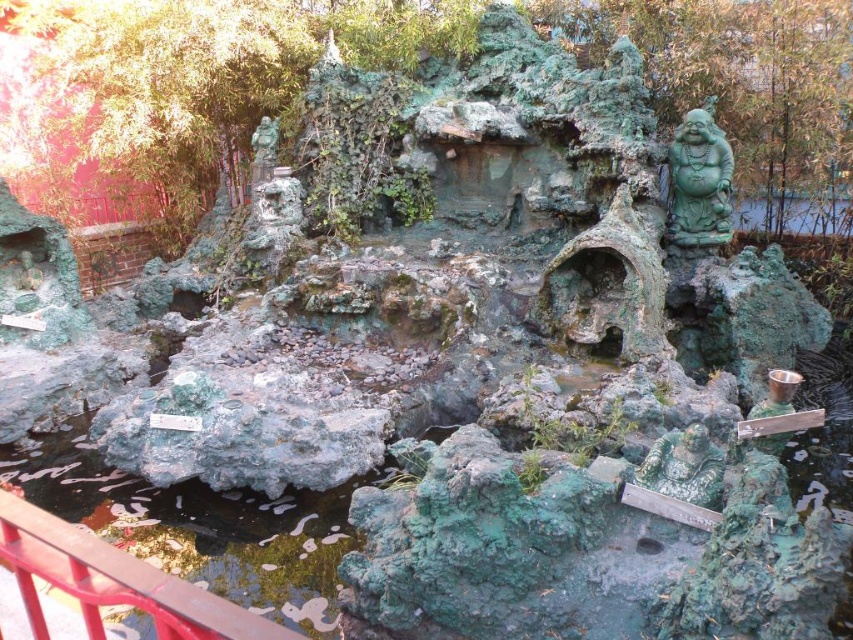
Question: Which of the following is the farthest from the observer?

Choices:
 (A) red metal railing at lower left
 (B) green patina statue at lower right
 (C) green patina statue at upper right

Answer: (C)

Question: Which is nearer to the green patina statue at upper right?

Choices:
 (A) red metal railing at lower left
 (B) green patina statue at lower right

Answer: (B)

Question: Does red metal railing at lower left appear on the left side of green patina statue at lower right?

Choices:
 (A) yes
 (B) no

Answer: (A)

Question: Is green patina statue at upper right smaller than green patina statue at lower right?

Choices:
 (A) no
 (B) yes

Answer: (A)

Question: Is green patina statue at upper right closer to the viewer compared to green patina statue at lower right?

Choices:
 (A) no
 (B) yes

Answer: (A)

Question: Which is farther from the red metal railing at lower left?

Choices:
 (A) green patina statue at lower right
 (B) green patina statue at upper right

Answer: (B)